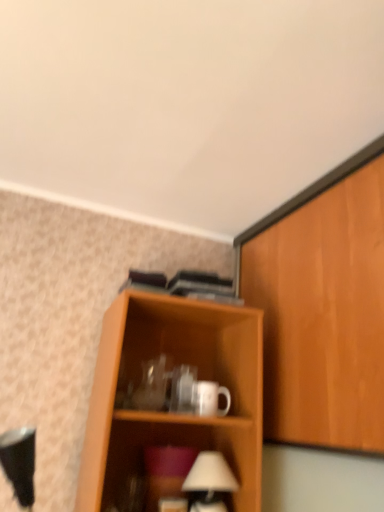
Question: Does white glossy mug at center contain wooden cabinet at right?

Choices:
 (A) no
 (B) yes

Answer: (A)

Question: Are white glossy mug at center and wooden cabinet at right beside each other?

Choices:
 (A) no
 (B) yes

Answer: (A)

Question: Is white glossy mug at center facing away from wooden cabinet at right?

Choices:
 (A) no
 (B) yes

Answer: (A)

Question: Is white glossy mug at center thinner than wooden cabinet at right?

Choices:
 (A) yes
 (B) no

Answer: (A)

Question: From a real-world perspective, does white glossy mug at center sit lower than wooden cabinet at right?

Choices:
 (A) no
 (B) yes

Answer: (B)

Question: In terms of height, does white glossy mug at center look taller or shorter compared to wooden cabinet at right?

Choices:
 (A) tall
 (B) short

Answer: (B)

Question: Is white glossy mug at center in front of or behind wooden cabinet at right in the image?

Choices:
 (A) behind
 (B) front

Answer: (A)

Question: From the image's perspective, is white glossy mug at center above or below wooden cabinet at right?

Choices:
 (A) below
 (B) above

Answer: (A)

Question: From a real-world perspective, is white glossy mug at center above or below wooden cabinet at right?

Choices:
 (A) above
 (B) below

Answer: (B)

Question: Considering the positions of white matte table lamp at lower center and white glossy mug at center in the image, is white matte table lamp at lower center wider or thinner than white glossy mug at center?

Choices:
 (A) thin
 (B) wide

Answer: (B)

Question: Which is correct: white matte table lamp at lower center is inside white glossy mug at center, or outside of it?

Choices:
 (A) outside
 (B) inside

Answer: (A)

Question: Considering the positions of white matte table lamp at lower center and white glossy mug at center in the image, is white matte table lamp at lower center bigger or smaller than white glossy mug at center?

Choices:
 (A) big
 (B) small

Answer: (A)

Question: Relative to white glossy mug at center, is white matte table lamp at lower center in front or behind?

Choices:
 (A) front
 (B) behind

Answer: (A)

Question: Would you say wooden cabinet at right is to the left or to the right of white glossy mug at center in the picture?

Choices:
 (A) left
 (B) right

Answer: (B)

Question: From the image's perspective, is wooden cabinet at right located above or below white glossy mug at center?

Choices:
 (A) above
 (B) below

Answer: (A)